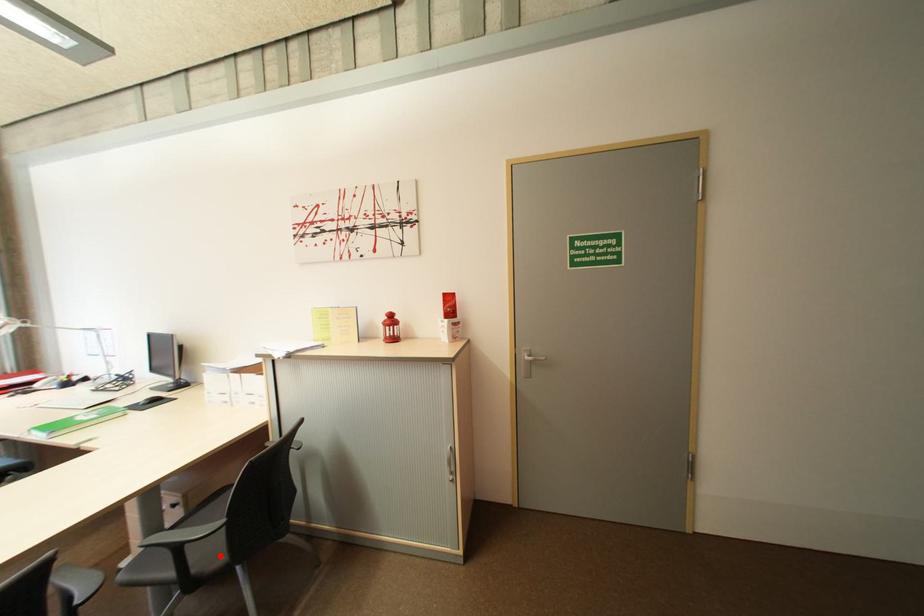
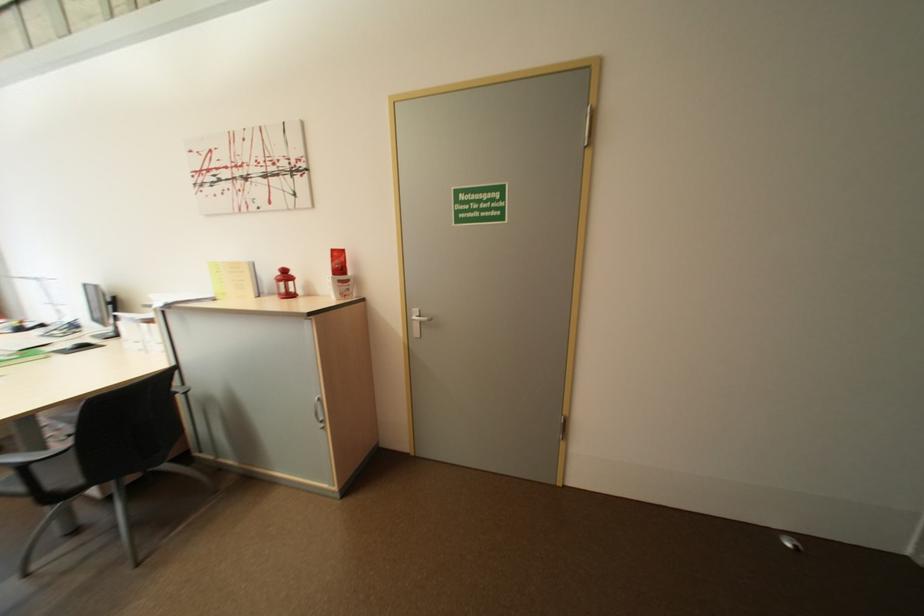
Question: I am providing you with two images of the same scene from different viewpoints. Image1 has a red point marked. In image2, the corresponding 3D location appears at what relative position? Reply with the corresponding letter.

Choices:
 (A) Closer
 (B) Farther

Answer: (B)